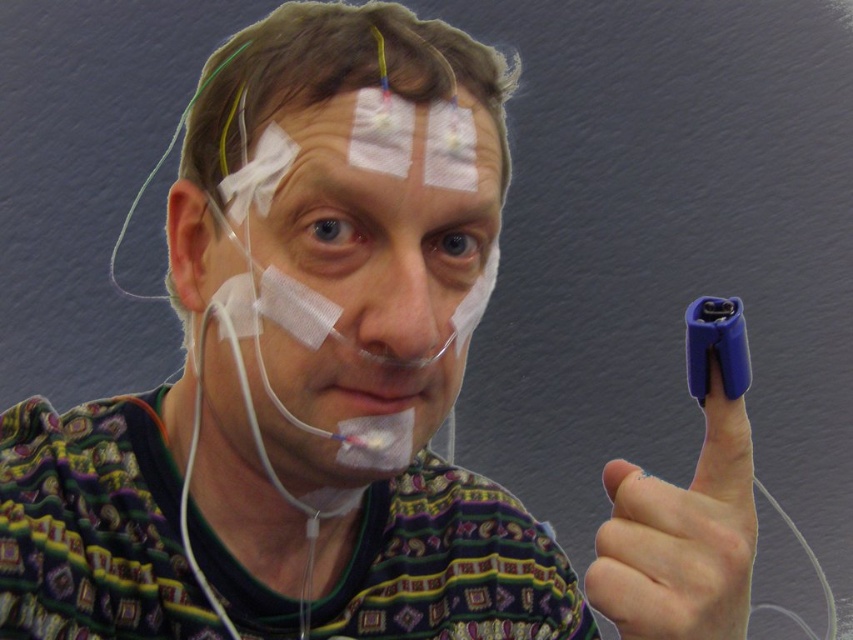
Question: Does purple rubber finger at upper right have a greater width compared to white adhesive tape at upper center?

Choices:
 (A) no
 (B) yes

Answer: (A)

Question: Which point appears farthest from the camera in this image?

Choices:
 (A) coord(490,285)
 (B) coord(704,515)
 (C) coord(392,125)

Answer: (A)

Question: Is white adhesive tape at upper center positioned at the back of matte white nose at center?

Choices:
 (A) no
 (B) yes

Answer: (B)

Question: Which point appears closest to the camera in this image?

Choices:
 (A) (384, 362)
 (B) (281, 262)
 (C) (624, 573)
 (D) (454, 115)

Answer: (C)

Question: Which of the following is the closest to the observer?

Choices:
 (A) matte white nose at center
 (B) white matte bandage at center
 (C) purple rubber finger at upper right

Answer: (C)

Question: Does purple rubber finger at upper right have a lesser width compared to matte white nose at center?

Choices:
 (A) yes
 (B) no

Answer: (B)